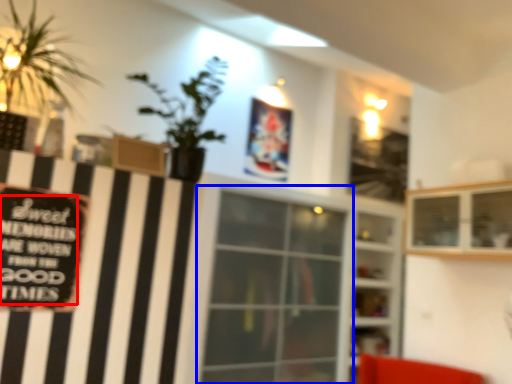
Question: Among these objects, which one is farthest to the camera, writing (highlighted by a red box) or window (highlighted by a blue box)?

Choices:
 (A) writing
 (B) window

Answer: (B)